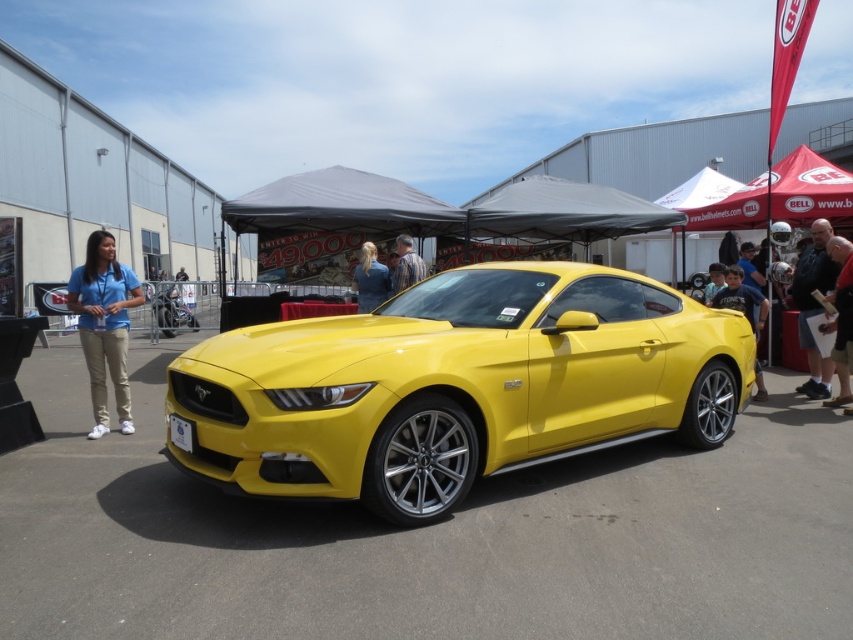
Question: From the image, what is the correct spatial relationship of matte blue shirt at left in relation to reddish-brown leather jacket at right?

Choices:
 (A) above
 (B) below

Answer: (A)

Question: Based on their relative distances, which object is nearer to the yellow glossy car at center?

Choices:
 (A) matte blue shirt at left
 (B) reddish-brown leather jacket at right
 (C) blue denim jacket at center
 (D) striped shirt at center

Answer: (B)

Question: Does yellow glossy car at center have a greater width compared to reddish-brown leather jacket at right?

Choices:
 (A) no
 (B) yes

Answer: (B)

Question: Can you confirm if yellow glossy car at center is positioned below reddish-brown leather jacket at right?

Choices:
 (A) no
 (B) yes

Answer: (B)

Question: Which object is closer to the camera taking this photo?

Choices:
 (A) matte blue shirt at left
 (B) yellow glossy car at center
 (C) striped shirt at center

Answer: (B)

Question: Which object is farther from the camera taking this photo?

Choices:
 (A) yellow glossy car at center
 (B) reddish-brown leather jacket at right
 (C) blue denim jacket at center

Answer: (C)